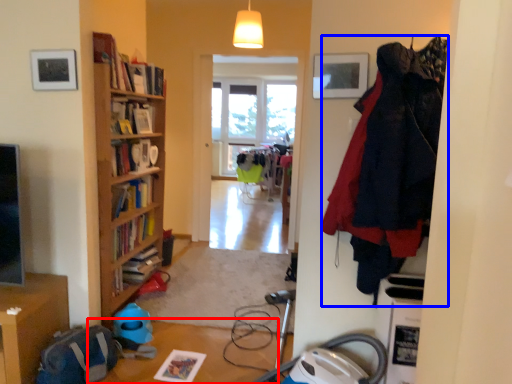
Question: Which of the following is the farthest to the observer, table (highlighted by a red box) or clothing (highlighted by a blue box)?

Choices:
 (A) table
 (B) clothing

Answer: (A)